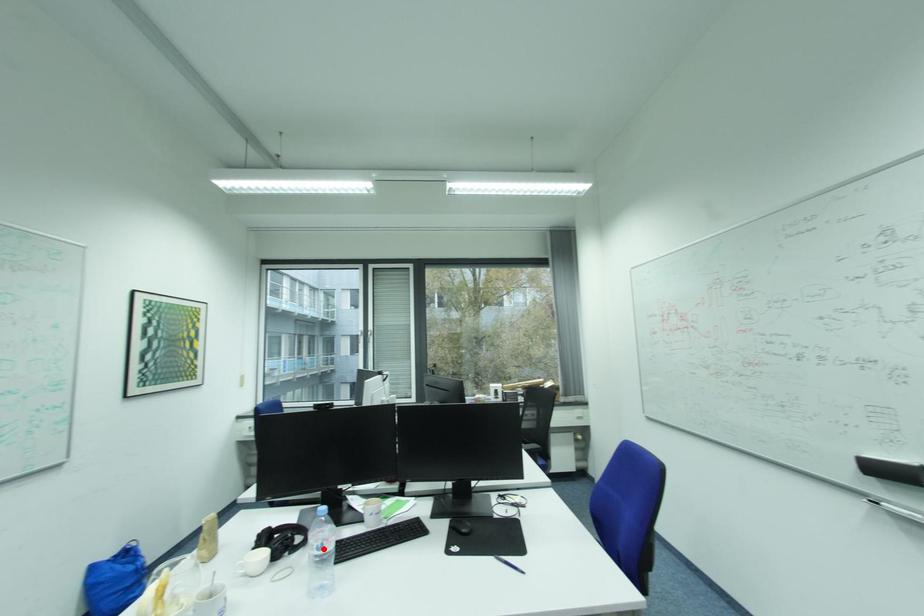
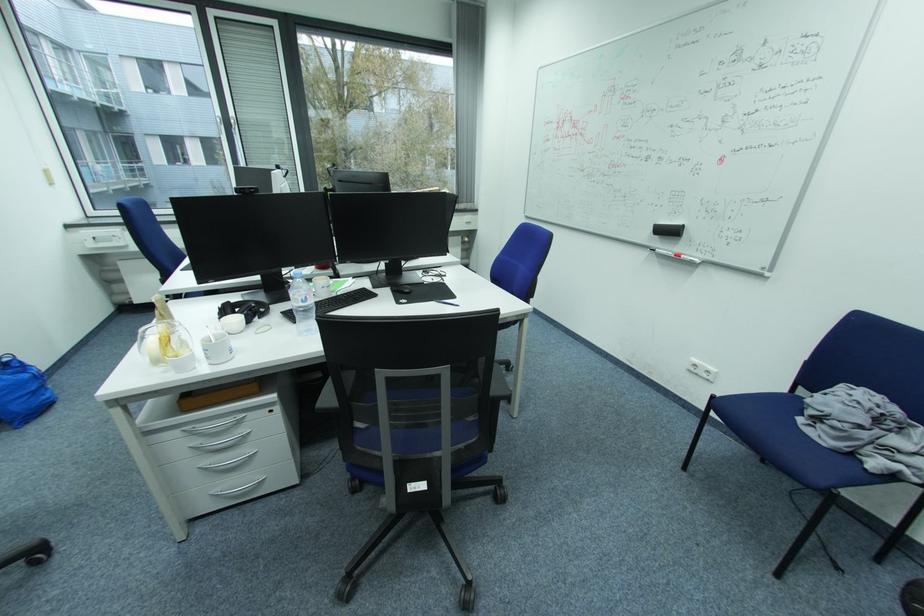
In the second image, find the point that corresponds to the highlighted location in the first image.

(310, 301)